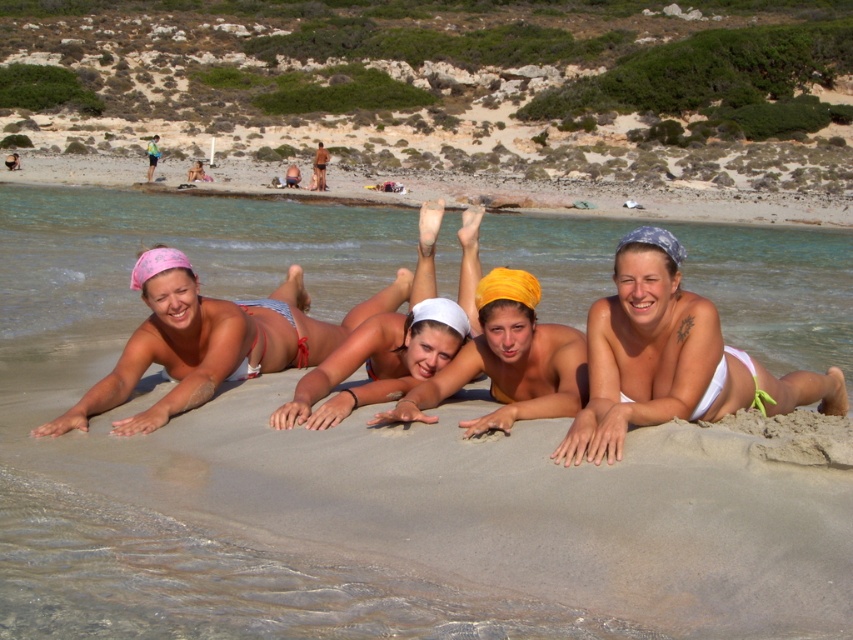
You are standing on the beach and see the white sand at center. Where would you find the point marked at coordinates (218, 582)?

The point marked at coordinates (218, 582) is located at the white sand at center.

You are a photographer standing at the edge of the beach. You want to take a photo that includes both the white matte bikini at center and the pink fabric bikini at center. What is the minimum distance you need to move backward to ensure both are fully in frame?

The white matte bikini at center and pink fabric bikini at center are 2.02 meters apart. To include both in the frame, you need to move back until your camera can capture a width of at least 2.02 meters. The exact distance depends on your camera lens, but moving back several meters should work.

You are a photographer trying to capture a closeup shot of the yellow fabric headscarf at center and the matte white bikini at center. Since you want to focus on the headscarf, which object should you zoom in on first, considering their sizes?

The yellow fabric headscarf at center has a larger width than the matte white bikini at center, so you should zoom in on the yellow fabric headscarf at center first to ensure it fits within the frame.